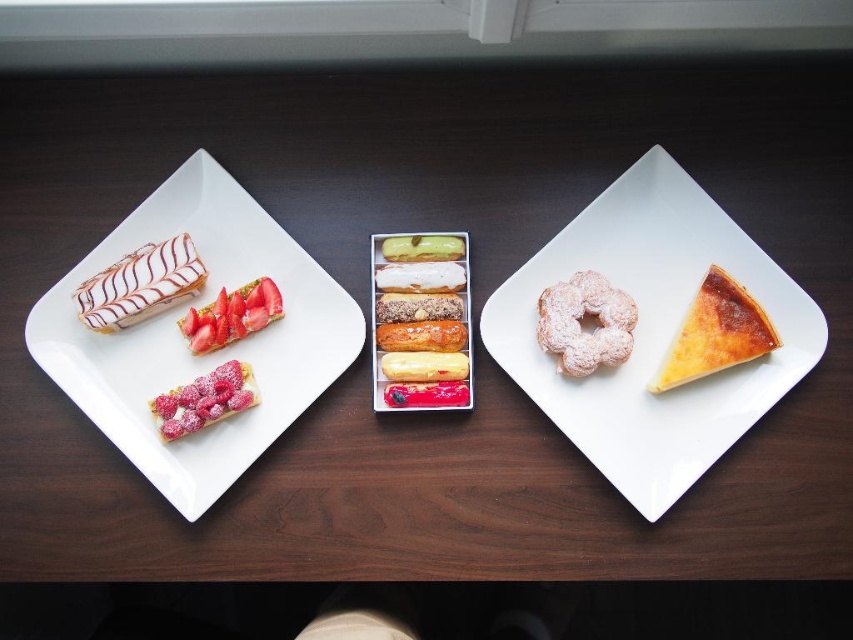
You are a customer at a bakery and want to grab the shiny metallic eclairs at center to take to your friend. However, there is a white glossy rectangular plate at upper left in the way. Can you reach the eclairs without moving the plate?

The white glossy rectangular plate at upper left is located below the shiny metallic eclairs at center, so the plate is not blocking the path to the eclairs. You can reach the shiny metallic eclairs at center without moving the plate.